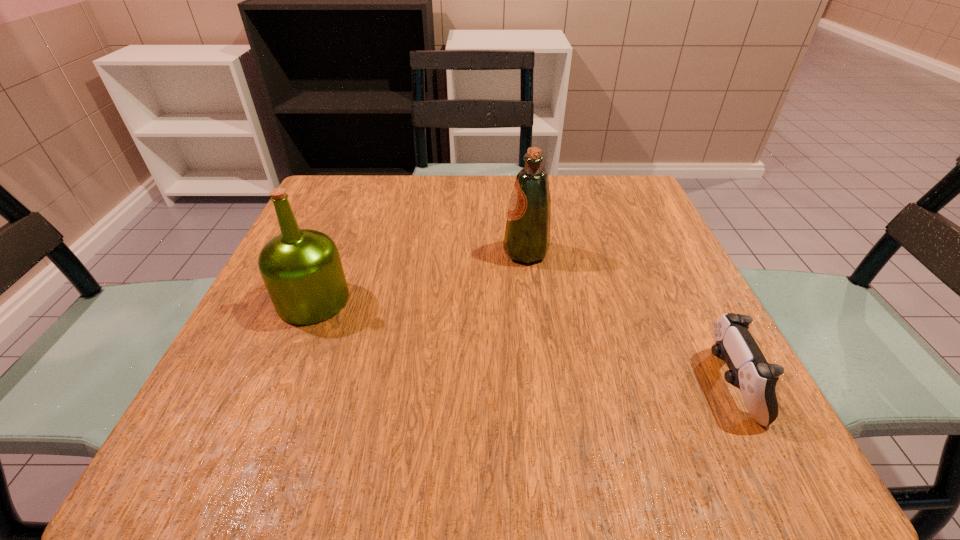
Identify the location of the farther olive oil. (527, 234).

I want to click on the second object from left to right, so click(527, 234).

This screenshot has height=540, width=960. I want to click on the nearer olive oil, so (301, 268).

This screenshot has height=540, width=960. Identify the location of the leftmost object. (301, 268).

In order to click on the shortest object in this screenshot , I will do `click(749, 371)`.

At what (x,y) coordinates should I click in order to perform the action: click on the rightmost object. Please return your answer as a coordinate pair (x, y). Looking at the image, I should click on (749, 371).

Image resolution: width=960 pixels, height=540 pixels. I want to click on free spot located on the front-facing side of the farther olive oil, so click(x=369, y=252).

Where is `free space located on the front-facing side of the farther olive oil`? This screenshot has width=960, height=540. free space located on the front-facing side of the farther olive oil is located at coordinates (474, 252).

Locate an element on the screen. Image resolution: width=960 pixels, height=540 pixels. vacant area located on the front-facing side of the farther olive oil is located at coordinates (479, 252).

Locate an element on the screen. This screenshot has width=960, height=540. free space located on the front of the nearer olive oil is located at coordinates (285, 368).